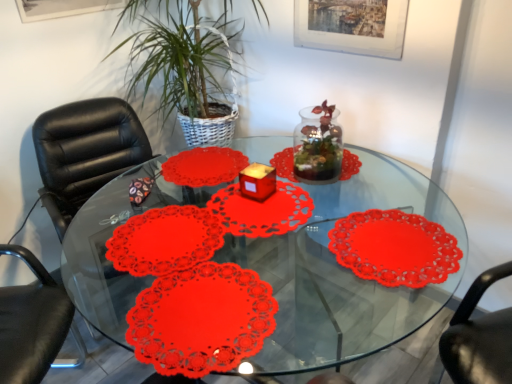
Question: Would you say matte paper doily at center is to the left or to the right of black leather chair at left in the picture?

Choices:
 (A) left
 (B) right

Answer: (B)

Question: Is point (181, 324) positioned closer to the camera than point (48, 160)?

Choices:
 (A) closer
 (B) farther

Answer: (A)

Question: Which object is the farthest from the transparent glass jar at center?

Choices:
 (A) matte paper doily at center
 (B) metallic silver picture frame at upper center
 (C) transparent plastic placemats at center
 (D) black leather chair at left
 (E) green leafy plant at center

Answer: (D)

Question: Which object is positioned farthest from the black leather chair at left?

Choices:
 (A) matte red candle holder at center
 (B) transparent plastic placemats at center
 (C) transparent glass jar at center
 (D) matte paper doily at center
 (E) green leafy plant at center

Answer: (D)